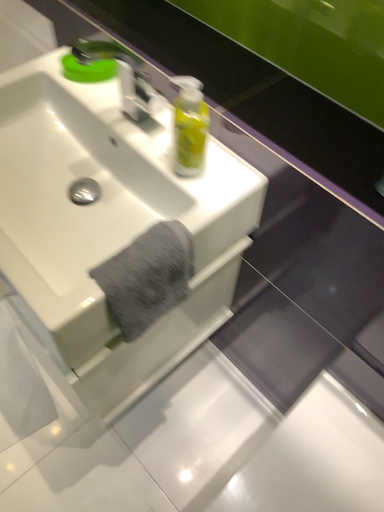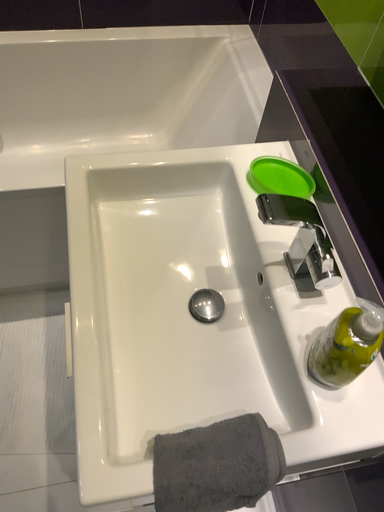
Question: Which way did the camera rotate in the video?

Choices:
 (A) rotated left
 (B) rotated right

Answer: (A)